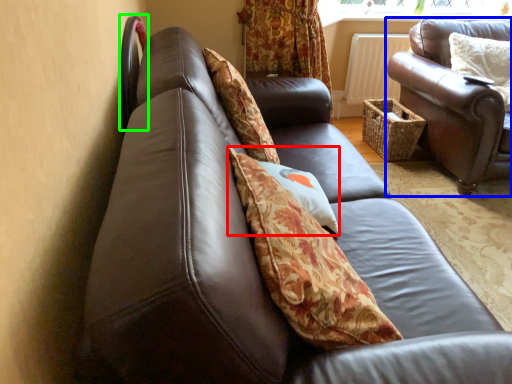
Question: Which object is the closest to the pillow (highlighted by a red box)? Choose among these: studio couch (highlighted by a blue box) or chair (highlighted by a green box).

Choices:
 (A) studio couch
 (B) chair

Answer: (B)